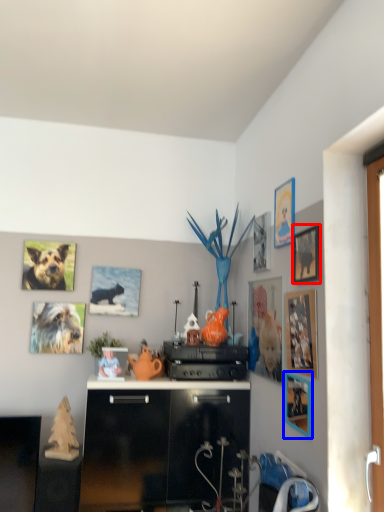
Question: Among these objects, which one is nearest to the camera, picture frame (highlighted by a red box) or picture frame (highlighted by a blue box)?

Choices:
 (A) picture frame
 (B) picture frame

Answer: (A)